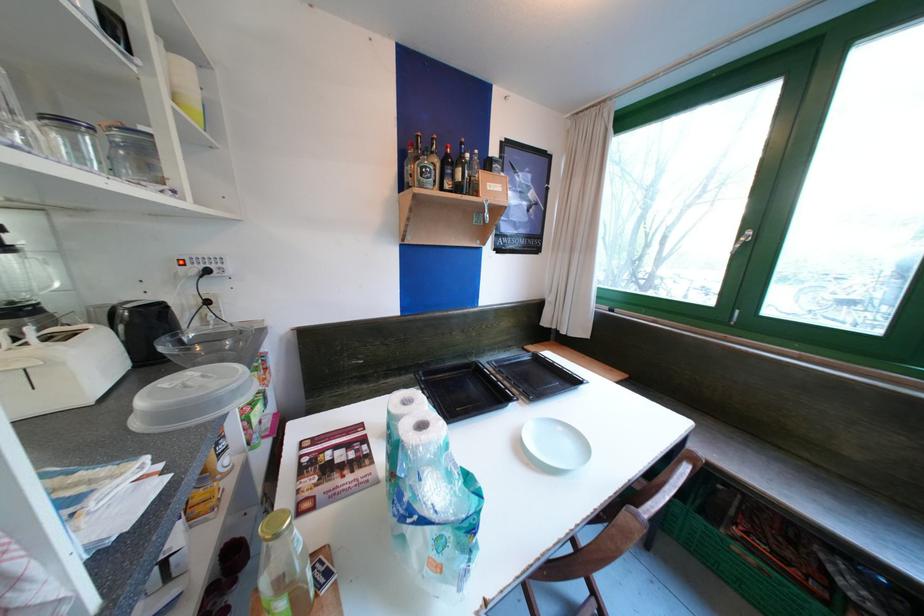
You are a GUI agent. You are given a task and a screenshot of the screen. Output one action in this format:
    pyautogui.click(x=<x>, y=<y>)
    Task: Click on the white plastic lid
    The image size is (924, 616).
    Given the screenshot: What is the action you would take?
    pyautogui.click(x=553, y=446)